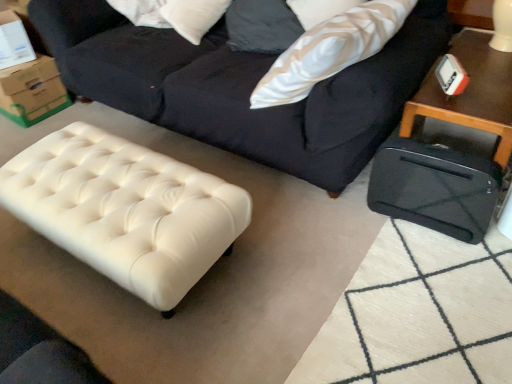
The height and width of the screenshot is (384, 512). Identify the location of free space above black plastic suitcase at right, the 1th table when ordered from right to left (from a real-world perspective). (484, 82).